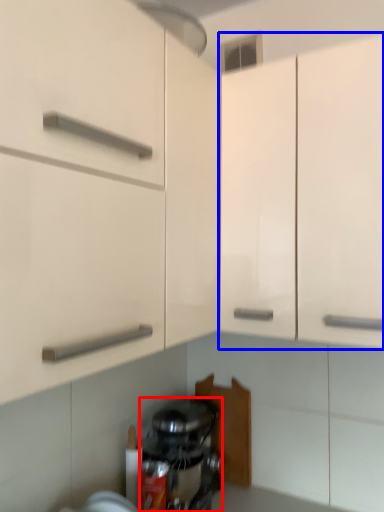
Question: Which point is closer to the camera, home appliance (highlighted by a red box) or cabinetry (highlighted by a blue box)?

Choices:
 (A) home appliance
 (B) cabinetry

Answer: (B)